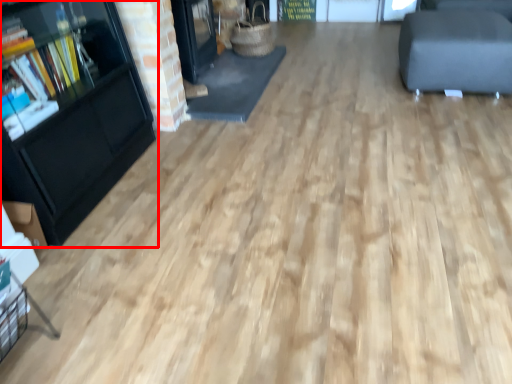
Question: From the image's perspective, where is bookcase (annotated by the red box) located relative to furniture?

Choices:
 (A) below
 (B) above

Answer: (A)